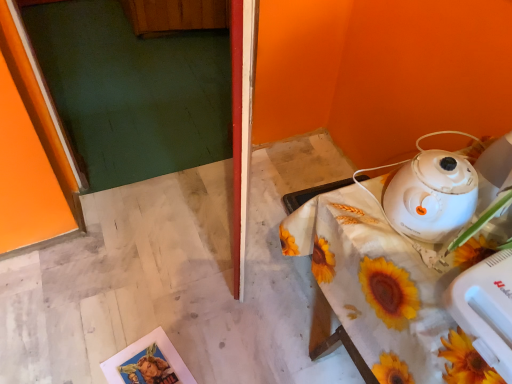
In order to click on vacant position to the left of white glossy kettle at upper right in this screenshot , I will do pyautogui.click(x=360, y=218).